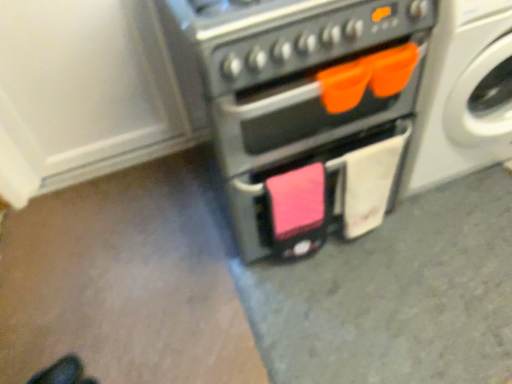
Question: From a real-world perspective, is black leather shoes at lower left positioned over white glossy washing machine at upper right based on gravity?

Choices:
 (A) yes
 (B) no

Answer: (B)

Question: Would you say black leather shoes at lower left contains white glossy washing machine at upper right?

Choices:
 (A) yes
 (B) no

Answer: (B)

Question: Does black leather shoes at lower left appear on the right side of white glossy washing machine at upper right?

Choices:
 (A) yes
 (B) no

Answer: (B)

Question: From the image's perspective, is black leather shoes at lower left above white glossy washing machine at upper right?

Choices:
 (A) no
 (B) yes

Answer: (A)

Question: Is black leather shoes at lower left aimed at white glossy washing machine at upper right?

Choices:
 (A) no
 (B) yes

Answer: (A)

Question: Do you think white glossy washing machine at upper right is within matte black oven at center, or outside of it?

Choices:
 (A) inside
 (B) outside

Answer: (B)

Question: From the image's perspective, is white glossy washing machine at upper right above or below matte black oven at center?

Choices:
 (A) above
 (B) below

Answer: (A)

Question: In the image, is white glossy washing machine at upper right positioned in front of or behind matte black oven at center?

Choices:
 (A) front
 (B) behind

Answer: (B)

Question: Based on their sizes in the image, would you say white glossy washing machine at upper right is bigger or smaller than matte black oven at center?

Choices:
 (A) big
 (B) small

Answer: (B)

Question: In terms of height, does black leather shoes at lower left look taller or shorter compared to white glossy washing machine at upper right?

Choices:
 (A) short
 (B) tall

Answer: (A)

Question: From a real-world perspective, is black leather shoes at lower left positioned above or below white glossy washing machine at upper right?

Choices:
 (A) above
 (B) below

Answer: (B)

Question: Is black leather shoes at lower left bigger or smaller than white glossy washing machine at upper right?

Choices:
 (A) big
 (B) small

Answer: (B)

Question: Choose the correct answer: Is black leather shoes at lower left inside white glossy washing machine at upper right or outside it?

Choices:
 (A) inside
 (B) outside

Answer: (B)

Question: Is matte black oven at center situated inside black leather shoes at lower left or outside?

Choices:
 (A) outside
 (B) inside

Answer: (A)

Question: From a real-world perspective, relative to black leather shoes at lower left, is matte black oven at center vertically above or below?

Choices:
 (A) above
 (B) below

Answer: (A)